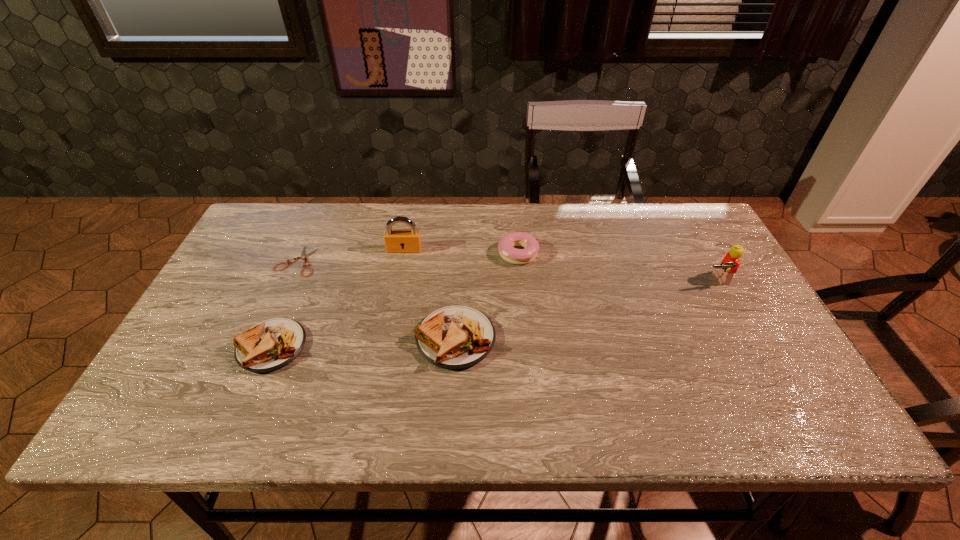
In order to click on the shorter sandwich in this screenshot , I will do `click(270, 345)`.

This screenshot has height=540, width=960. What are the coordinates of `the fourth object from left to right` in the screenshot? It's located at (455, 337).

Where is `the taller sandwich`? Image resolution: width=960 pixels, height=540 pixels. the taller sandwich is located at coordinates (455, 337).

The height and width of the screenshot is (540, 960). Find the location of `Lego`. Lego is located at coordinates (729, 265).

Image resolution: width=960 pixels, height=540 pixels. What are the coordinates of `the shortest object` in the screenshot? It's located at pos(303,256).

At what (x,y) coordinates should I click in order to perform the action: click on doughnut. Please return your answer as a coordinate pair (x, y). The width and height of the screenshot is (960, 540). Looking at the image, I should click on [x=506, y=244].

Locate an element on the screen. The image size is (960, 540). padlock is located at coordinates (396, 241).

I want to click on vacant space located on the back of the shorter sandwich, so click(323, 225).

At what (x,y) coordinates should I click in order to perform the action: click on free space located 0.320m on the right of the right sandwich. Please return your answer as a coordinate pair (x, y). Image resolution: width=960 pixels, height=540 pixels. Looking at the image, I should click on (626, 339).

Where is `free space located in front of the rightmost object with the accessory visible`? The image size is (960, 540). free space located in front of the rightmost object with the accessory visible is located at coordinates (741, 329).